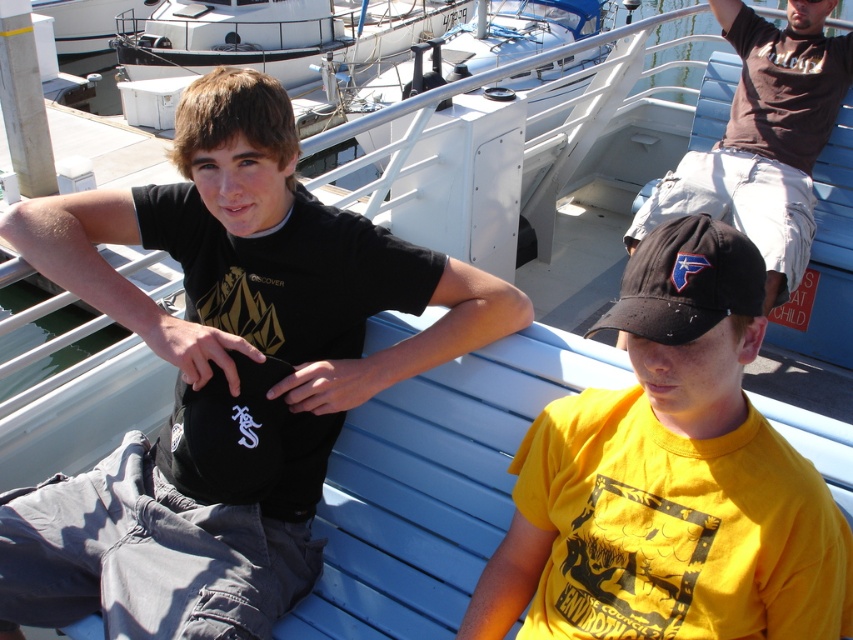
Does black matte t-shirt at upper left appear under black fabric baseball cap at lower center?

Yes.

Does black matte t-shirt at upper left come in front of black fabric baseball cap at lower center?

No, it is not.

Find the location of `black matte t-shirt at upper left`. black matte t-shirt at upper left is located at coordinates (235, 349).

Does black matte t-shirt at upper left lie in front of matte brown t-shirt at upper right?

Yes, it is.

Does black matte t-shirt at upper left appear on the right side of matte brown t-shirt at upper right?

In fact, black matte t-shirt at upper left is to the left of matte brown t-shirt at upper right.

Between point (283, 256) and point (776, 116), which one is positioned behind?

Positioned behind is point (776, 116).

Identify the location of black matte t-shirt at upper left. The height and width of the screenshot is (640, 853). (235, 349).

Which of these two, white glossy boat at upper center or black fabric baseball cap at lower center, stands taller?

white glossy boat at upper center is taller.

Does white glossy boat at upper center appear over black fabric baseball cap at lower center?

Yes.

This screenshot has width=853, height=640. What are the coordinates of `white glossy boat at upper center` in the screenshot? It's located at (276, 35).